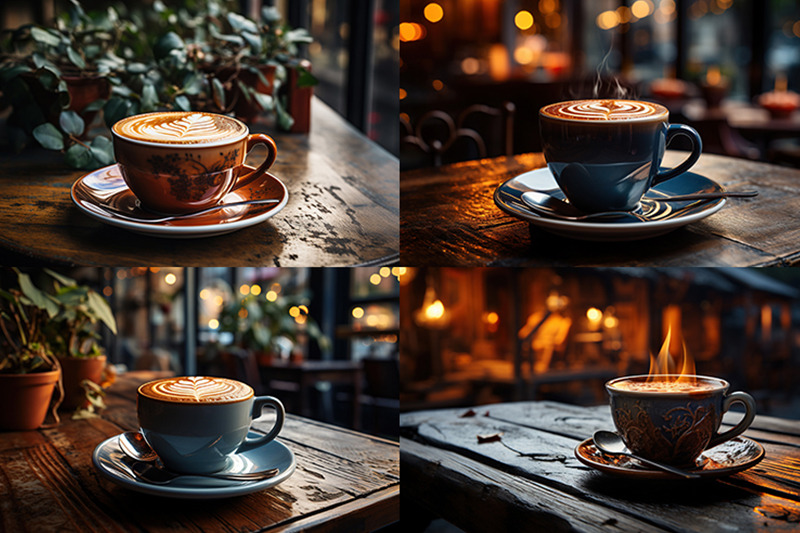
What are the coordinates of `plate` in the screenshot? It's located at (218, 218), (273, 453), (625, 460), (602, 218).